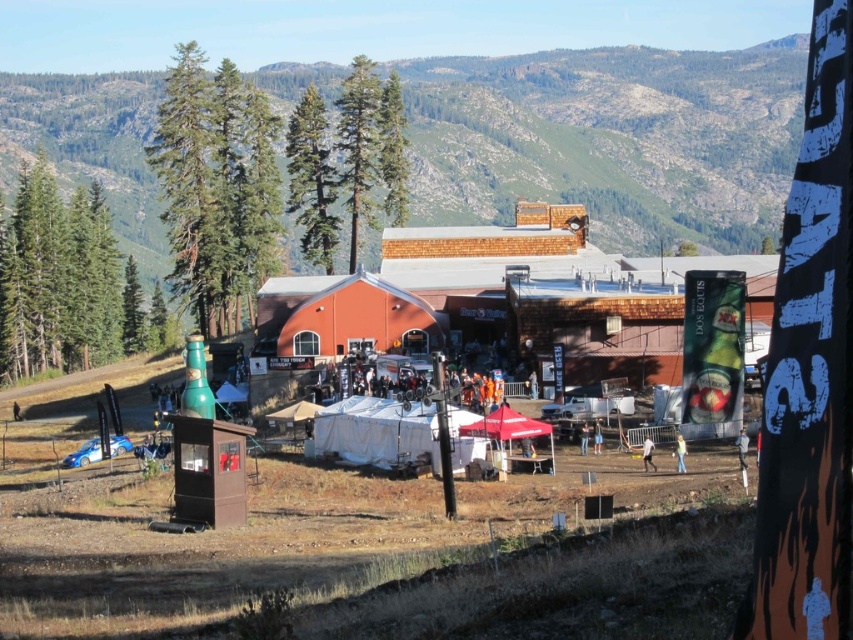
Does green textured mountain at upper center appear under green coniferous tree at upper center?

Actually, green textured mountain at upper center is above green coniferous tree at upper center.

Which is behind, point (59, 97) or point (364, 74)?

Point (59, 97)

Locate an element on the screen. The height and width of the screenshot is (640, 853). green textured mountain at upper center is located at coordinates (610, 140).

Identify the location of green textured mountain at upper center. Image resolution: width=853 pixels, height=640 pixels. [x=610, y=140].

Does green textured tree at left have a larger size compared to green textured pine tree at upper center?

No, green textured tree at left is not bigger than green textured pine tree at upper center.

Is green textured tree at left closer to camera compared to green textured pine tree at upper center?

No, green textured tree at left is behind green textured pine tree at upper center.

Between point (51, 212) and point (300, 124), which one is positioned behind?

Point (51, 212)

Locate an element on the screen. The height and width of the screenshot is (640, 853). green textured tree at left is located at coordinates (68, 284).

Is green textured tree at left wider than green coniferous tree at upper center?

Yes.

Does green textured tree at left appear under green coniferous tree at upper center?

Yes, green textured tree at left is below green coniferous tree at upper center.

This screenshot has height=640, width=853. I want to click on green textured tree at left, so click(x=68, y=284).